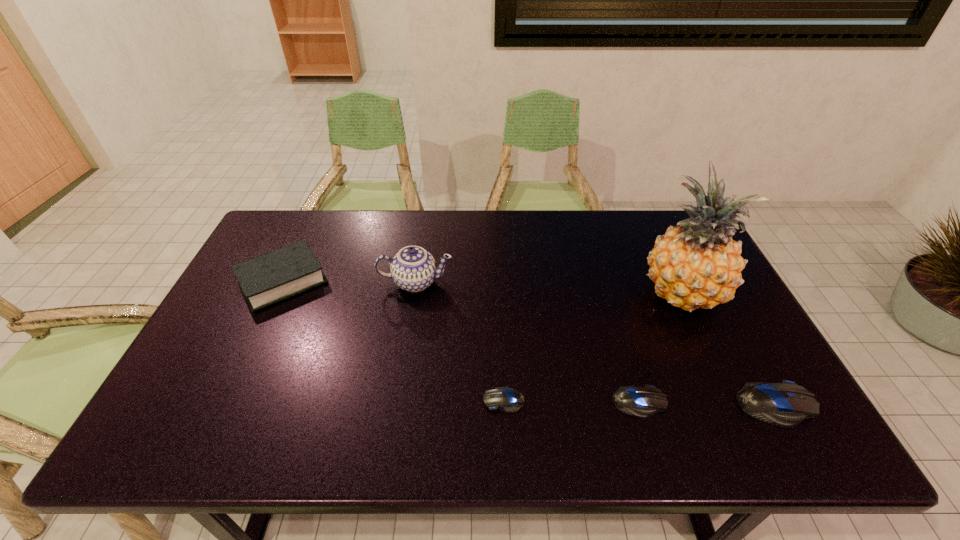
Identify the location of vacant space that's between the second object from left to right and the shortest computer mouse. (460, 341).

Image resolution: width=960 pixels, height=540 pixels. I want to click on vacant space that's between the leftmost object and the third shortest object, so click(x=529, y=343).

At what (x,y) coordinates should I click in order to perform the action: click on vacant area between the rightmost computer mouse and the chinaware. Please return your answer as a coordinate pair (x, y). This screenshot has width=960, height=540. Looking at the image, I should click on (595, 343).

Locate an element on the screen. empty space that is in between the pineapple and the Bible is located at coordinates (482, 287).

The height and width of the screenshot is (540, 960). In order to click on empty space that is in between the fifth tallest object and the shortest computer mouse in this screenshot , I will do `click(572, 401)`.

Image resolution: width=960 pixels, height=540 pixels. What are the coordinates of `free space between the shortest computer mouse and the leftmost object` in the screenshot? It's located at pos(394,341).

Locate which object ranks third in proximity to the second shortest computer mouse. Please provide its 2D coordinates. Your answer should be formatted as a tuple, i.e. [(x, y)], where the tuple contains the x and y coordinates of a point satisfying the conditions above.

[(509, 400)]

The height and width of the screenshot is (540, 960). Identify the location of object that is the fourth closest to the rightmost computer mouse. (x=413, y=269).

Where is `the closest computer mouse to the fourth object from left to right`? This screenshot has height=540, width=960. the closest computer mouse to the fourth object from left to right is located at coordinates (786, 404).

The width and height of the screenshot is (960, 540). I want to click on computer mouse that is the second closest to the third shortest object, so click(x=509, y=400).